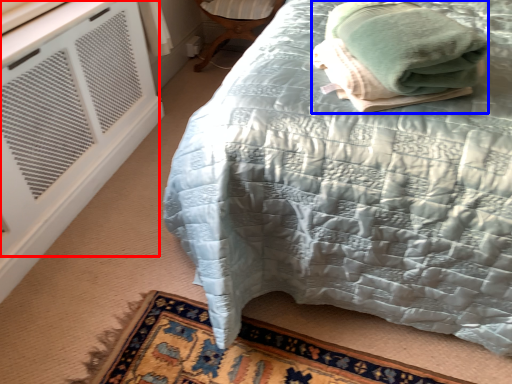
Question: Among these objects, which one is farthest to the camera, air conditioning (highlighted by a red box) or bath towel (highlighted by a blue box)?

Choices:
 (A) air conditioning
 (B) bath towel

Answer: (A)